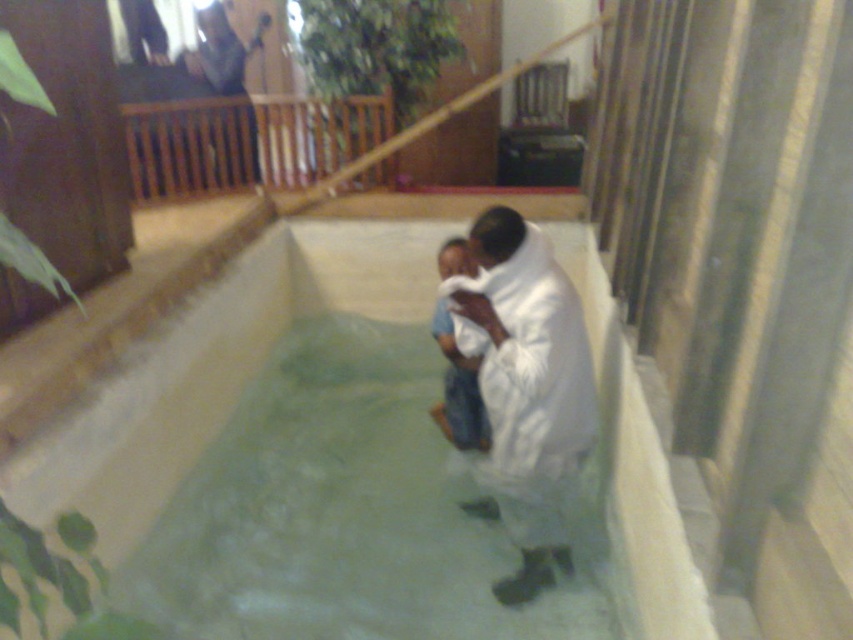
You are a visitor in the room and want to place a small potted plant on the white cotton cloth at center without it falling off. Is the brown wooden balustrade at upper left providing any support or barrier to prevent the plant from sliding off the edge?

The brown wooden balustrade at upper left is positioned over the white cotton cloth at center, so it acts as a barrier that prevents the plant from sliding off the edge.

You are a photographer standing at the edge of the pool. You want to capture a closeup shot of both the white fluffy blanket at center and the white cotton cloth at center in the same frame. Given that your camera has a maximum focus range of 30 centimeters, can you achieve this without moving the objects?

The white fluffy blanket at center is 28.18 centimeters away from the white cotton cloth at center. Since the distance between them is within the camera maximum focus range of 30 centimeters, you can capture both objects in the same frame without moving them.

You are an interior designer assessing the layout of a ceremonial space. You notice the white fabric at center and the matte black dress at upper center. Which object is positioned lower in the scene?

The white fabric at center is positioned below the matte black dress at upper center, so it is lower in the scene.